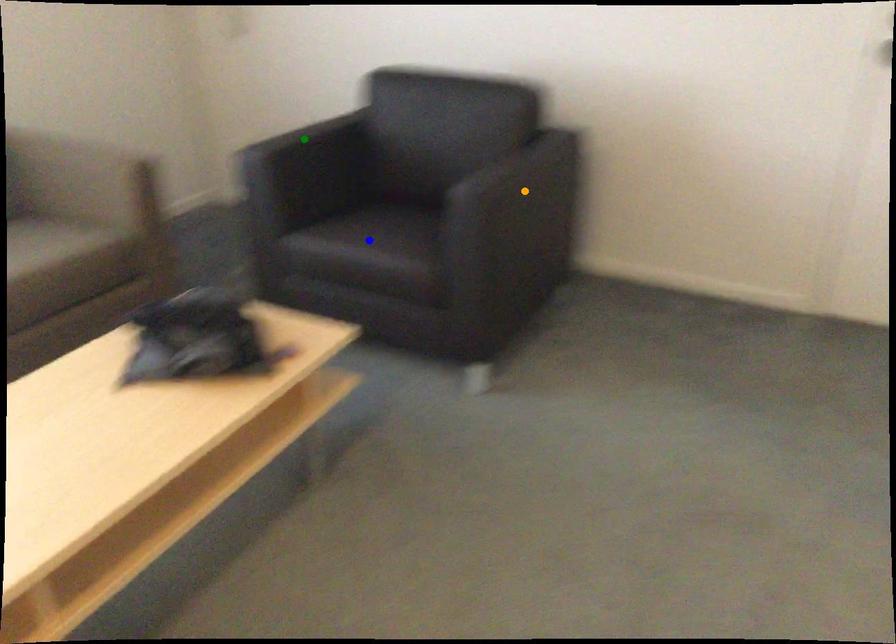
Order these from nearest to farthest:
green point, blue point, orange point

orange point → blue point → green point